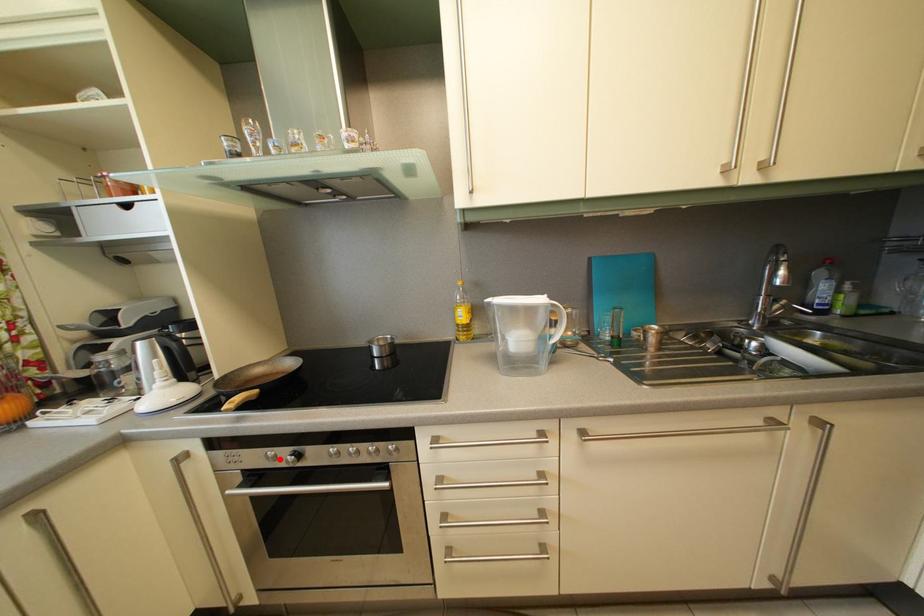
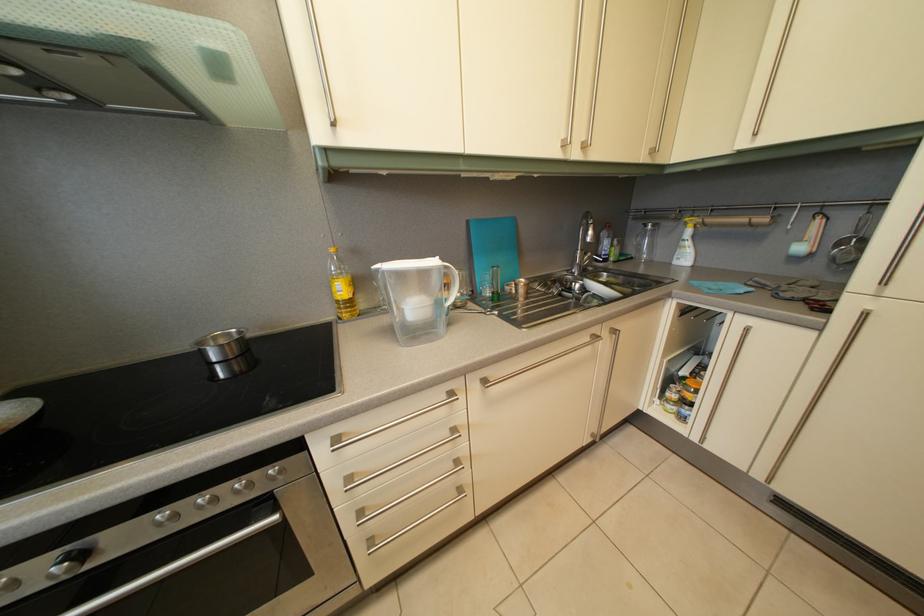
In the second image, find the point that corresponds to the highlighted location in the first image.

(8, 586)